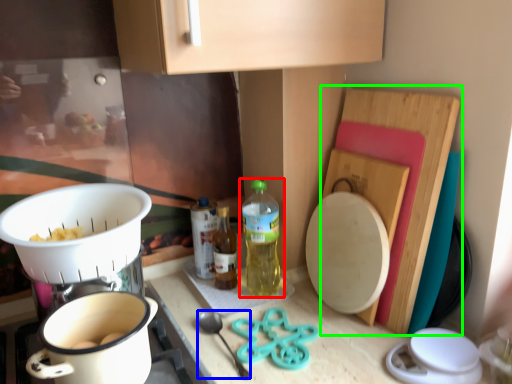
Question: Considering the real-world distances, which object is closest to bottle (highlighted by a red box)? utensil (highlighted by a blue box) or cutting board (highlighted by a green box).

Choices:
 (A) utensil
 (B) cutting board

Answer: (A)